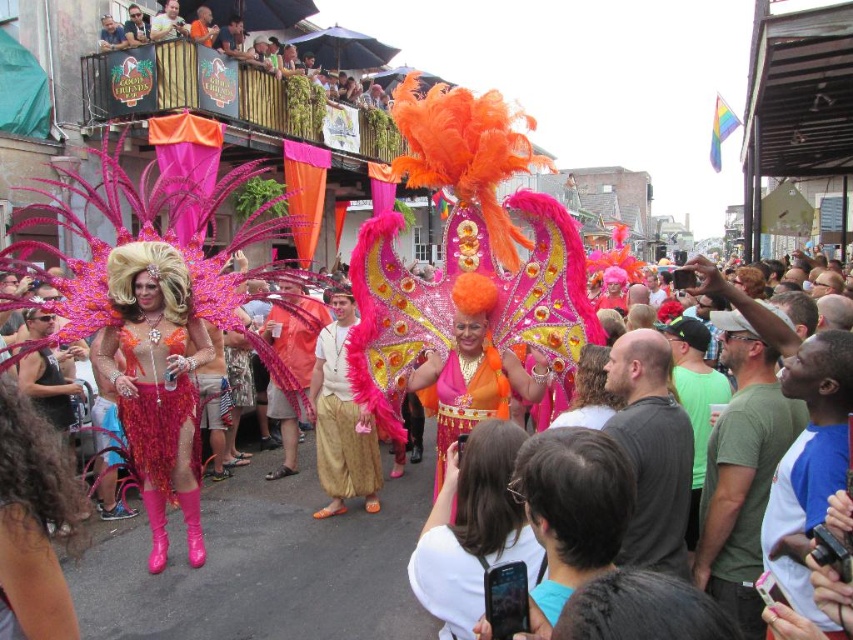
Question: Does shiny sequined skirt at center have a smaller size compared to shiny orange fabric at center?

Choices:
 (A) no
 (B) yes

Answer: (B)

Question: Considering the real-world distances, which object is farthest from the orange sequined dress at center?

Choices:
 (A) orange sequined headdress at center
 (B) gold woven fabric skirt at center

Answer: (A)

Question: Does gold woven fabric skirt at center appear under shiny orange fabric at center?

Choices:
 (A) no
 (B) yes

Answer: (A)

Question: Does shiny orange fabric at center appear on the right side of orange sequined headdress at center?

Choices:
 (A) yes
 (B) no

Answer: (A)

Question: Which object is closer to the camera taking this photo?

Choices:
 (A) shiny sequined dress at center
 (B) gold woven fabric skirt at center

Answer: (A)

Question: Which object is closer to the camera taking this photo?

Choices:
 (A) orange sequined dress at center
 (B) orange sequined headdress at center
 (C) gold woven fabric skirt at center
 (D) shiny orange fabric at center

Answer: (D)